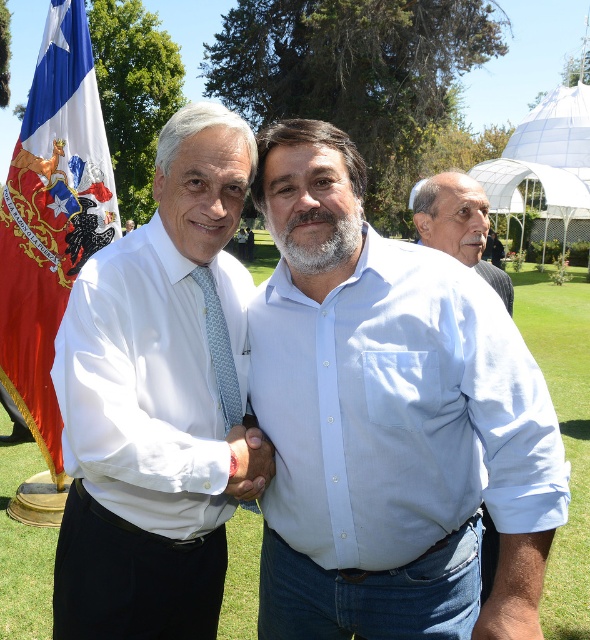
Question: Which object appears farthest from the camera in this image?

Choices:
 (A) light blue patterned tie at center
 (B) matte skin hand at lower right
 (C) smooth skin hand at center

Answer: (A)

Question: Which of the following is the farthest from the observer?

Choices:
 (A) (526, 625)
 (B) (421, 198)

Answer: (B)

Question: From the image, what is the correct spatial relationship of light blue patterned tie at center in relation to smooth skin hand at center?

Choices:
 (A) below
 (B) above

Answer: (B)

Question: Does white cotton shirt at center appear under matte skin hand at lower right?

Choices:
 (A) no
 (B) yes

Answer: (A)

Question: Which point is closer to the camera taking this photo?

Choices:
 (A) (64, 518)
 (B) (209, 289)

Answer: (A)

Question: Can you confirm if white shirt at center is positioned below red-white-blue fabric flag at left?

Choices:
 (A) yes
 (B) no

Answer: (A)